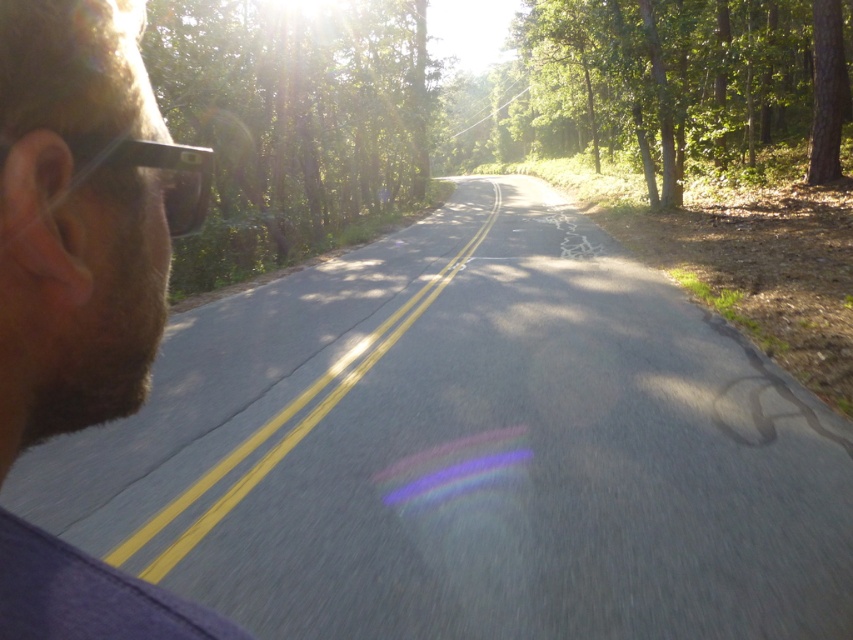
Between beige hair at left and green leafy tree at upper right, which one is positioned lower?

Positioned lower is beige hair at left.

Can you confirm if beige hair at left is smaller than green leafy tree at upper right?

Yes, beige hair at left is smaller than green leafy tree at upper right.

Who is more distant from viewer, (103, 42) or (576, 129)?

The point (576, 129) is more distant.

Where is `beige hair at left`? beige hair at left is located at coordinates (82, 216).

Can you confirm if beige hair at left is positioned above green leafy tree at upper center?

Actually, beige hair at left is below green leafy tree at upper center.

Between beige hair at left and green leafy tree at upper center, which one appears on the left side from the viewer's perspective?

green leafy tree at upper center is more to the left.

Between point (50, 150) and point (316, 161), which one is positioned behind?

Positioned behind is point (316, 161).

Identify the location of beige hair at left. Image resolution: width=853 pixels, height=640 pixels. (82, 216).

Is beige hair at left further to the viewer compared to transparent plastic glasses at left?

No, beige hair at left is in front of transparent plastic glasses at left.

Does beige hair at left appear on the left side of transparent plastic glasses at left?

In fact, beige hair at left is to the right of transparent plastic glasses at left.

At what (x,y) coordinates should I click in order to perform the action: click on beige hair at left. Please return your answer as a coordinate pair (x, y). The image size is (853, 640). Looking at the image, I should click on (82, 216).

At what (x,y) coordinates should I click in order to perform the action: click on beige hair at left. Please return your answer as a coordinate pair (x, y). Looking at the image, I should click on coord(82,216).